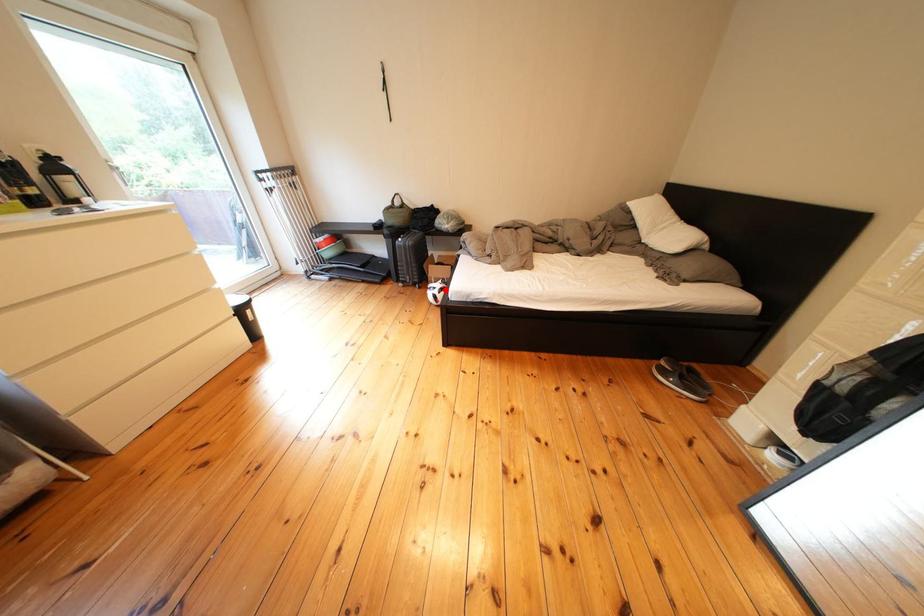
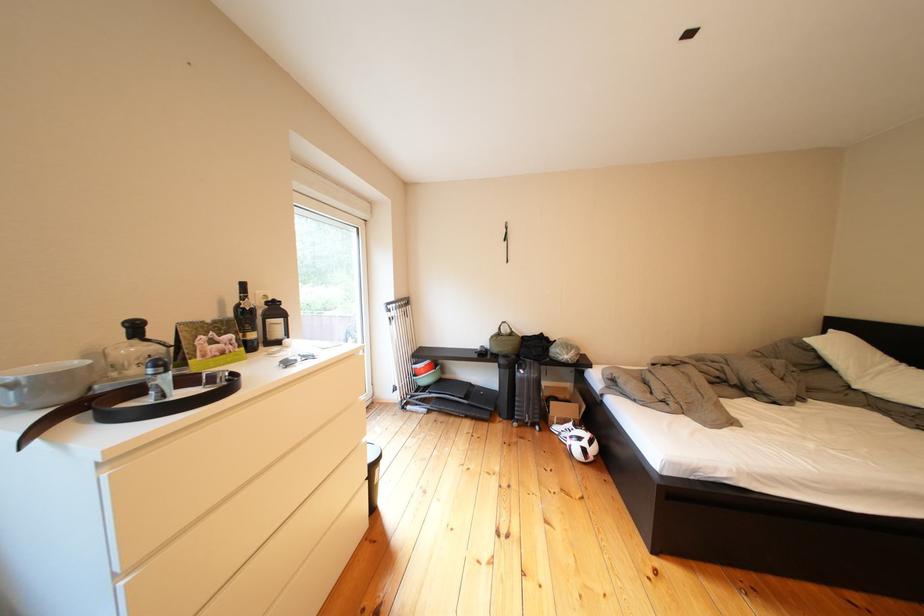
Question: I am providing you with two images of the same scene from different viewpoints. Given a red point in image1, look at the same physical point in image2. Is it:

Choices:
 (A) Closer to the viewpoint
 (B) Farther from the viewpoint

Answer: (A)